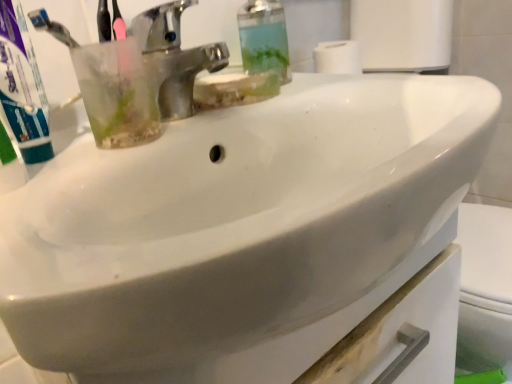
In order to click on empty space that is to the right of green matte toothpaste at left in this screenshot , I will do `click(161, 135)`.